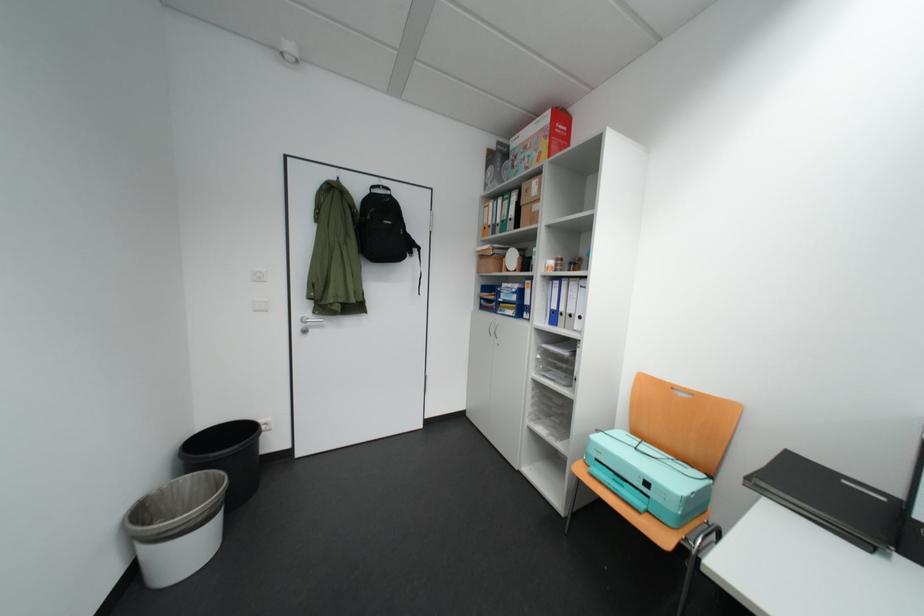
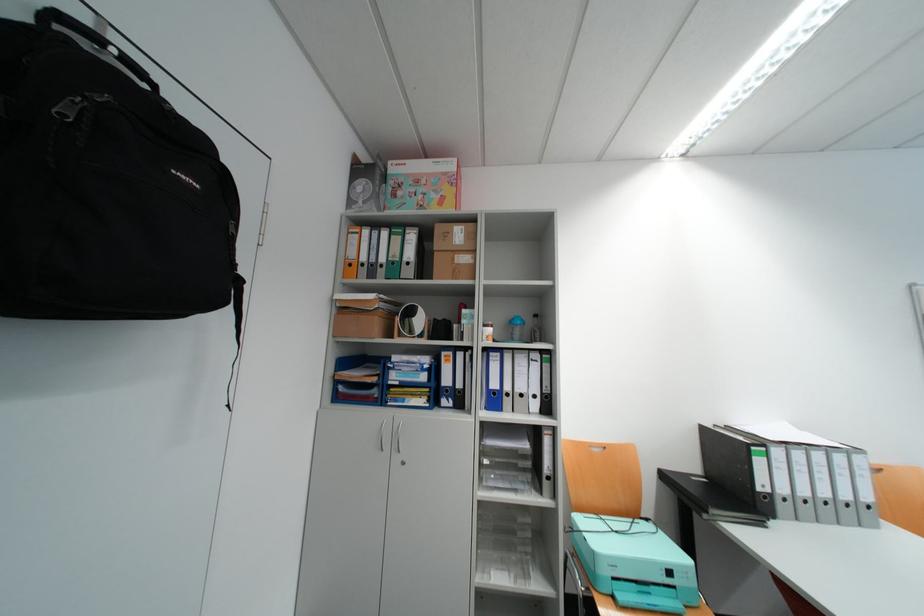
Locate, in the second image, the point that corresponds to [541,424] in the first image.

(491, 581)